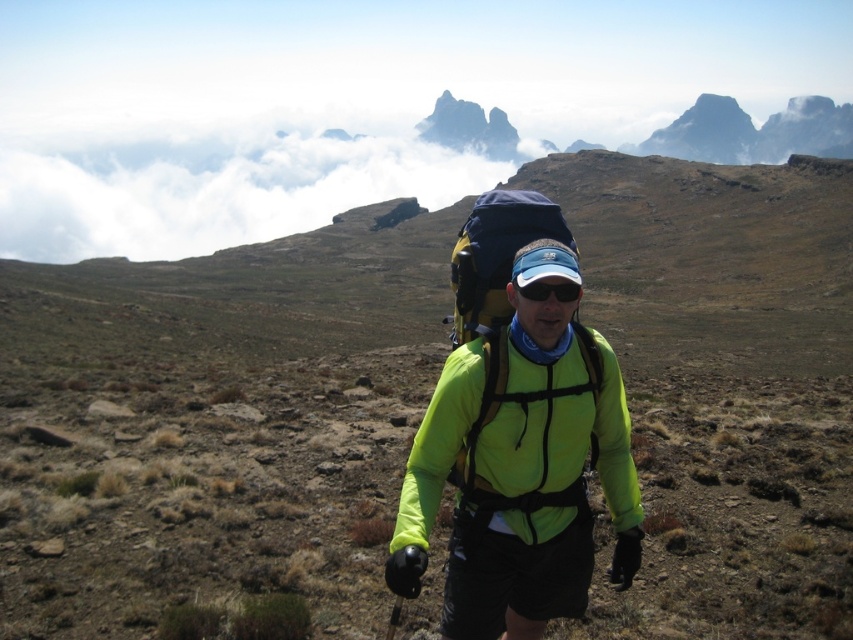
In the scene shown: You are a drone operator trying to capture a photo of the hiker. The drone can only fly up to 700 meters away from its starting position. There is a specific point at coordinates point [183,177] that you need to check. Is the drone able to reach that point without exceeding its maximum range?

The distance of point [183,177] from camera is 768.24 meters, which exceeds the drone maximum range of 700 meters. Therefore, the drone cannot reach that point without exceeding its maximum range.

You are a photographer trying to capture the hiker in the image. You want to ensure both the neon green fabric jacket at center and the navy blue fabric backpack at center are clearly visible in your shot. Given their sizes, which object should you focus on first to ensure it doesn t get lost in the background?

The neon green fabric jacket at center has a smaller size compared to the navy blue fabric backpack at center, so you should focus on the neon green fabric jacket at center first to ensure its details are captured clearly and it doesn t get lost against the background.